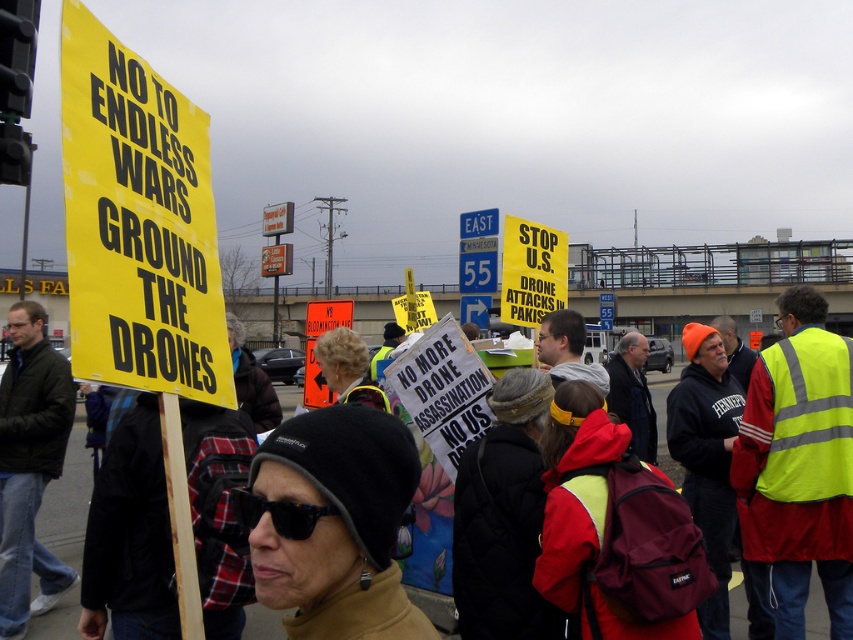
Question: Which is nearer to the black plastic sunglasses at center?

Choices:
 (A) yellow paper sign at left
 (B) yellow paper sign at center

Answer: (A)

Question: Among these points, which one is nearest to the camera?

Choices:
 (A) (1, 420)
 (B) (561, 269)
 (C) (608, 477)

Answer: (C)

Question: Which object is positioned farthest from the yellow paper sign at left?

Choices:
 (A) reflective yellow safety vest at center
 (B) dark green jacket at left

Answer: (B)

Question: In this image, where is yellow paper sign at left located relative to reflective yellow safety vest at center?

Choices:
 (A) right
 (B) left

Answer: (B)

Question: Is reflective yellow safety vest at center further to the viewer compared to yellow paper sign at center?

Choices:
 (A) no
 (B) yes

Answer: (A)

Question: Is reflective yellow safety vest at center below yellow paper sign at center?

Choices:
 (A) no
 (B) yes

Answer: (B)